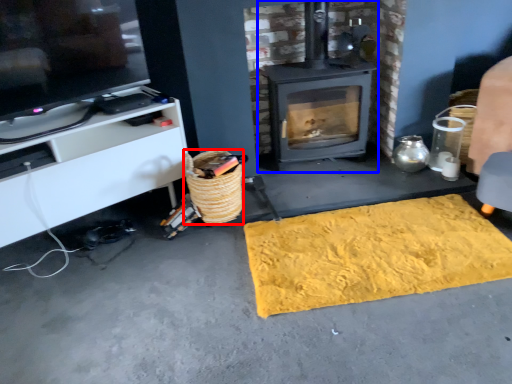
Question: Which of the following is the closest to the observer, basket (highlighted by a red box) or wood burning stove (highlighted by a blue box)?

Choices:
 (A) basket
 (B) wood burning stove

Answer: (A)